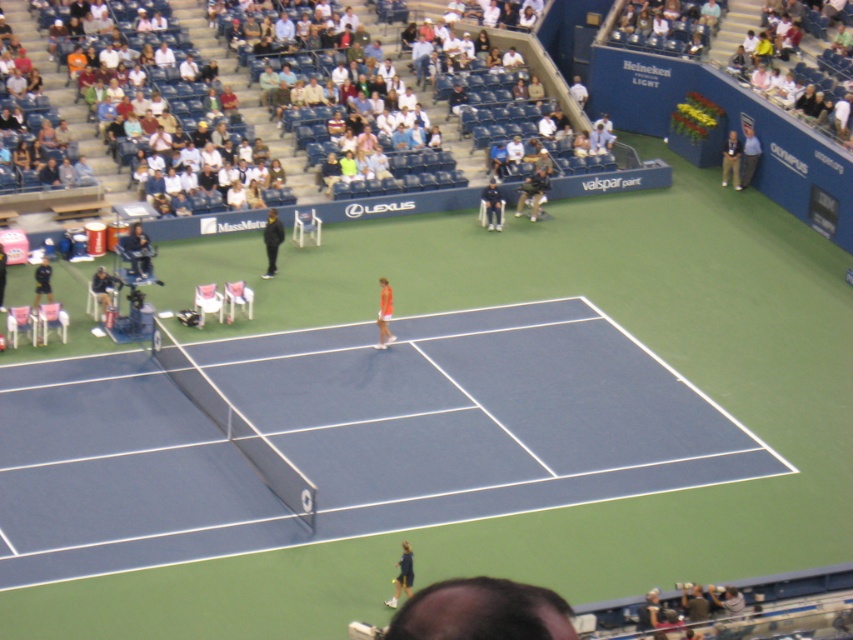
Looking at this image, you are a tennis ball that just landed on the court. You need to determine if you are currently on the blue synthetic surface at center. What should you check?

The blue synthetic surface at center is located at point [343,436], so you should check if your current position matches those coordinates to confirm you are on it.

In the scene shown: You are a tennis ball that just bounced on the blue synthetic surface at center. Which direction should you roll to reach the black matte jacket at upper center?

The blue synthetic surface at center is in front of the black matte jacket at upper center, so the tennis ball should roll backward to reach the black matte jacket at upper center.